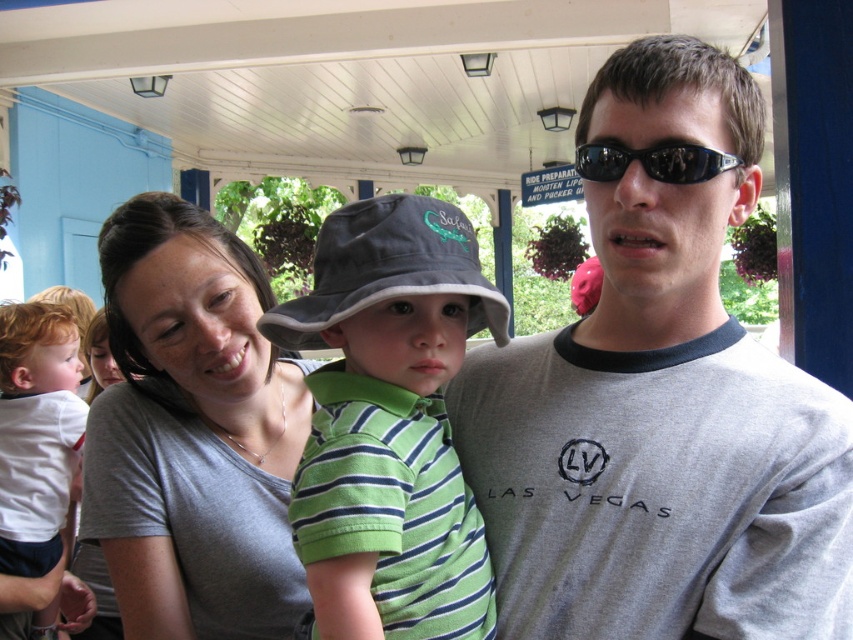
Question: Does matte gray shirt at center have a lesser width compared to green striped shirt at center?

Choices:
 (A) yes
 (B) no

Answer: (B)

Question: Can you confirm if white cotton shirt at left is wider than black plastic sunglasses at center?

Choices:
 (A) yes
 (B) no

Answer: (A)

Question: Which point is closer to the camera taking this photo?

Choices:
 (A) (21, 372)
 (B) (418, 225)
 (C) (717, 156)

Answer: (C)

Question: Estimate the real-world distances between objects in this image. Which object is closer to the green striped shirt at center?

Choices:
 (A) gray fabric hat at center
 (B) black plastic sunglasses at center
 (C) white cotton shirt at left

Answer: (A)

Question: Which of the following is the closest to the observer?

Choices:
 (A) white cotton shirt at left
 (B) matte gray shirt at center

Answer: (B)

Question: Where is matte gray shirt at center located in relation to gray fabric hat at center in the image?

Choices:
 (A) left
 (B) right

Answer: (A)